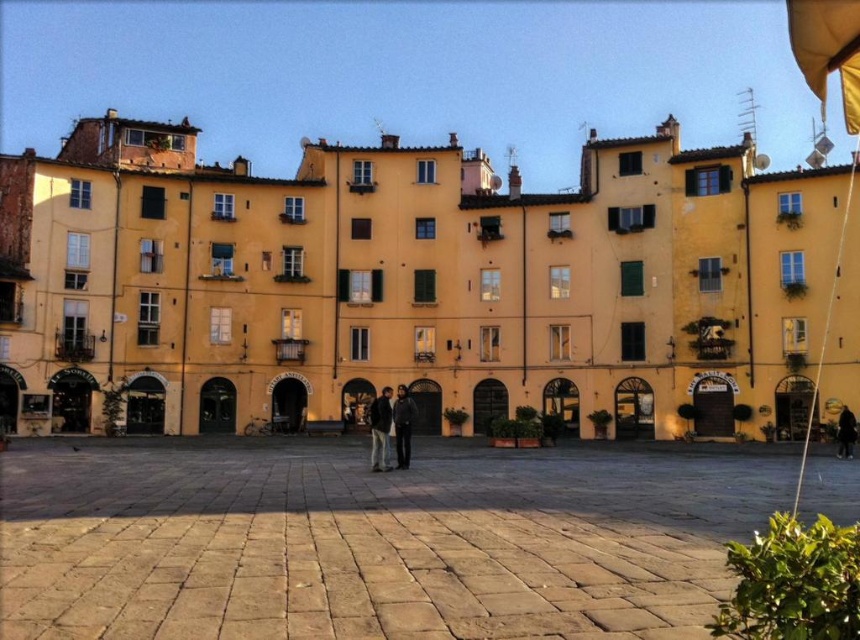
Question: Which of the following is the farthest from the observer?

Choices:
 (A) dark gray fabric jacket at center
 (B) dark blue jeans at center
 (C) brown stone pavement at center

Answer: (B)

Question: Can you confirm if yellow matte building at center is bigger than dark gray fabric jacket at center?

Choices:
 (A) yes
 (B) no

Answer: (A)

Question: Can you confirm if dark gray fabric jacket at center is positioned to the left of dark gray jacket at center?

Choices:
 (A) no
 (B) yes

Answer: (B)

Question: Can you confirm if dark blue jeans at center is positioned above dark gray jacket at center?

Choices:
 (A) yes
 (B) no

Answer: (B)

Question: Which of the following is the farthest from the observer?

Choices:
 (A) (410, 204)
 (B) (373, 456)
 (C) (306, 474)

Answer: (A)

Question: Which point is closer to the camera?

Choices:
 (A) coord(311,461)
 (B) coord(404,403)

Answer: (B)